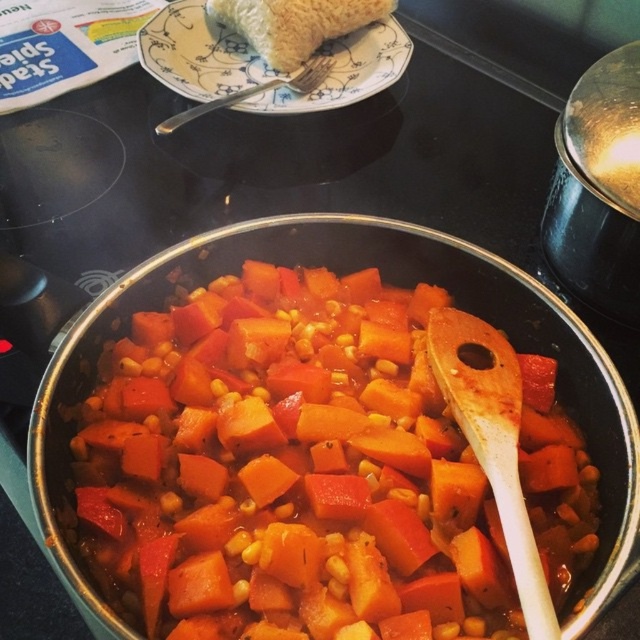
Where is `orange matte carrot at center`? Image resolution: width=640 pixels, height=640 pixels. orange matte carrot at center is located at coordinates (288, 468).

Is orange matte carrot at center bigger than porcelain plate at upper center?

Correct, orange matte carrot at center is larger in size than porcelain plate at upper center.

You are a GUI agent. You are given a task and a screenshot of the screen. Output one action in this format:
    pyautogui.click(x=<x>, y=<y>)
    Task: Click on the orange matte carrot at center
    
    Given the screenshot: What is the action you would take?
    point(288,468)

Which is below, porcelain plate at upper center or silver metallic fork at upper center?

Positioned lower is silver metallic fork at upper center.

Is porcelain plate at upper center closer to camera compared to silver metallic fork at upper center?

No, porcelain plate at upper center is further to the viewer.

Is point (230, 45) more distant than point (237, 93)?

Yes, point (230, 45) is behind point (237, 93).

Locate an element on the screen. porcelain plate at upper center is located at coordinates (198, 52).

Is porcelain plate at upper center closer to camera compared to wooden spoon at center?

That is False.

Between point (170, 4) and point (449, 337), which one is positioned in front?

Point (449, 337) is in front.

From the picture: Measure the distance between point (369, 28) and camera.

1.15 meters

Locate an element on the screen. porcelain plate at upper center is located at coordinates (198, 52).